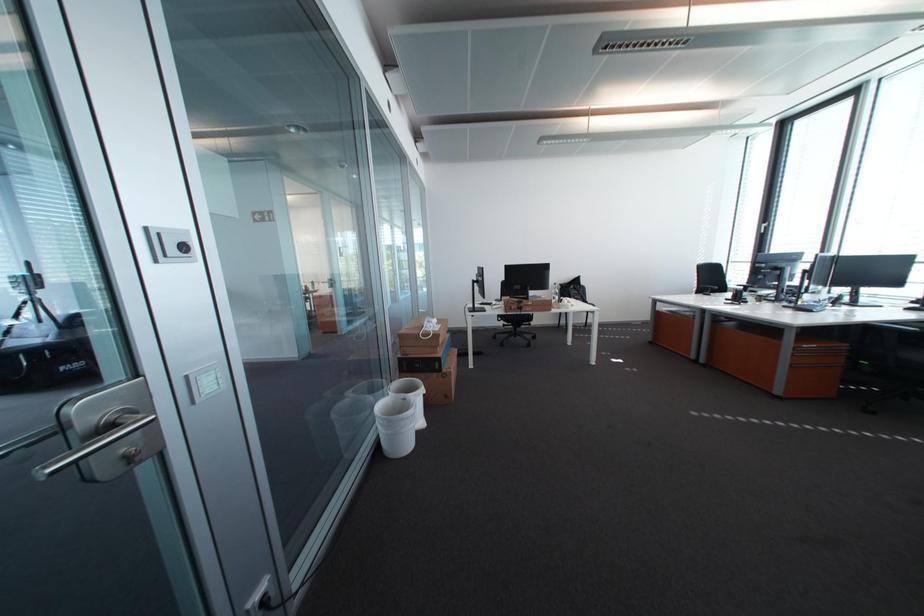
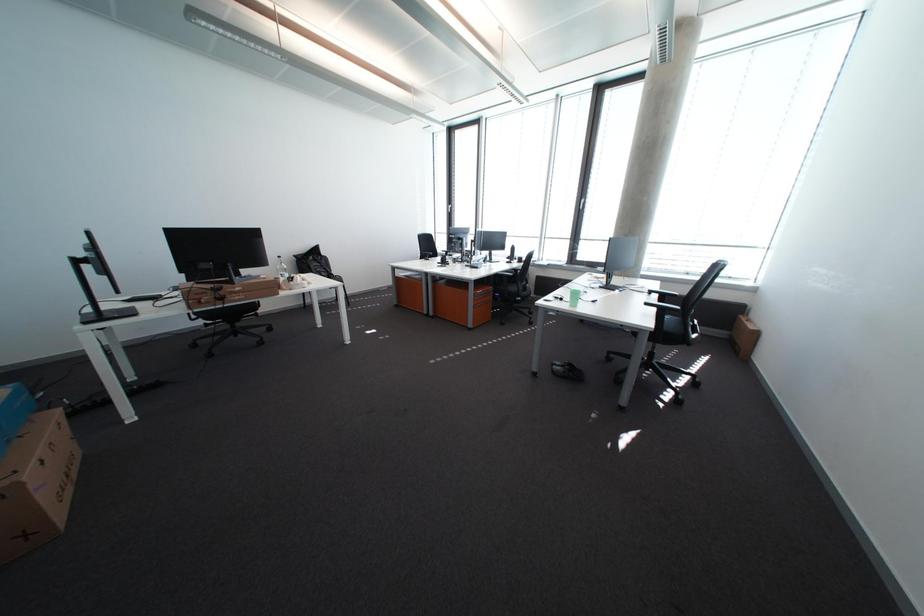
Question: The images are taken continuously from a first-person perspective. In which direction is your viewpoint rotating?

Choices:
 (A) Left
 (B) Right
 (C) Up
 (D) Down

Answer: (B)